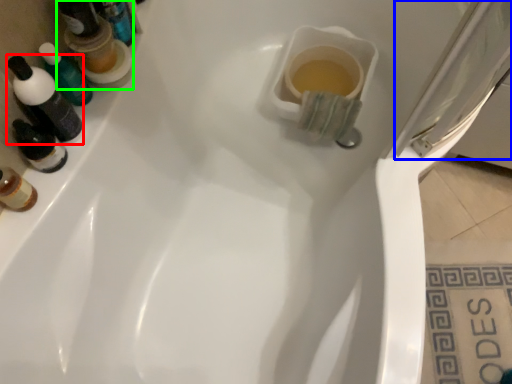
Question: Estimate the real-world distances between objects in this image. Which object is closer to mouthwash (highlighted by a red box), screen door (highlighted by a blue box) or mouthwash (highlighted by a green box)?

Choices:
 (A) screen door
 (B) mouthwash

Answer: (B)